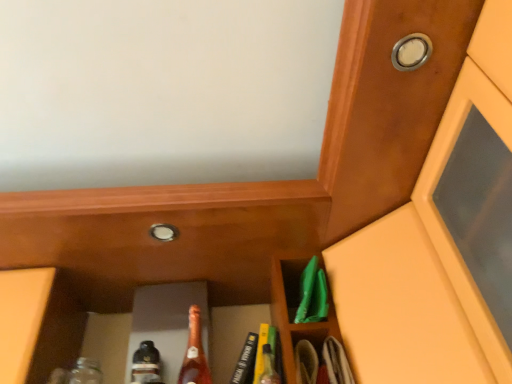
Where is `free space behind metallic silver knob at upper right, the 2th knob positioned from the left`? The height and width of the screenshot is (384, 512). free space behind metallic silver knob at upper right, the 2th knob positioned from the left is located at coordinates (399, 120).